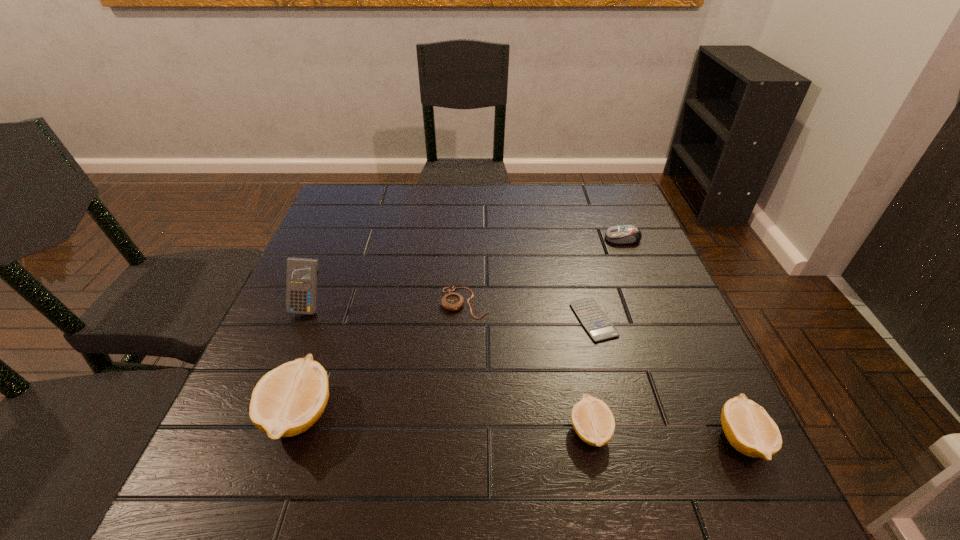
This screenshot has width=960, height=540. I want to click on vacant area situated 0.120m on the back of the third object from left to right, so click(467, 256).

Find the location of a particular element. free space located 0.220m on the front of the shortest object is located at coordinates (625, 440).

Identify the location of lemon present at the left edge. (288, 400).

The width and height of the screenshot is (960, 540). Find the location of `calculator present at the left edge`. calculator present at the left edge is located at coordinates (301, 279).

Identify the location of lemon present at the right edge. (748, 427).

In order to click on computer mouse situated at the right edge in this screenshot , I will do `click(624, 234)`.

Locate an element on the screen. The height and width of the screenshot is (540, 960). calculator at the right edge is located at coordinates (598, 325).

Locate an element on the screen. The height and width of the screenshot is (540, 960). object positioned at the near left corner is located at coordinates (288, 400).

Locate an element on the screen. This screenshot has width=960, height=540. object at the near right corner is located at coordinates point(748,427).

This screenshot has height=540, width=960. Identify the location of vacant space at the far edge. (579, 224).